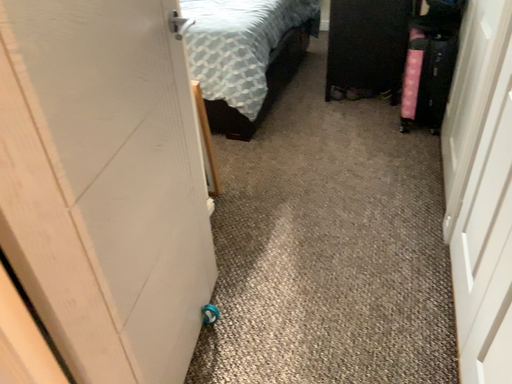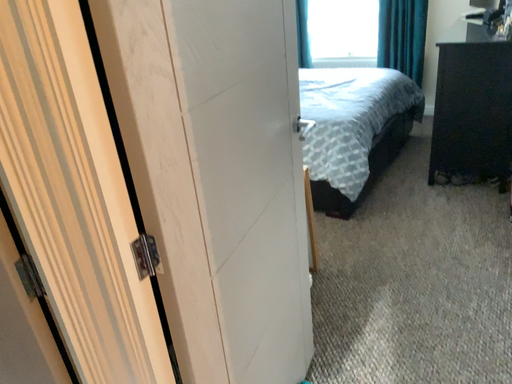
Question: Which way did the camera rotate in the video?

Choices:
 (A) rotated left
 (B) rotated right

Answer: (A)